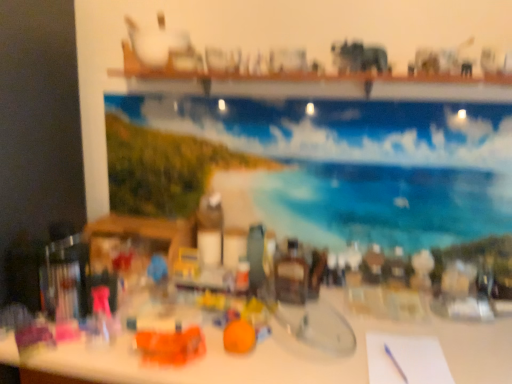
Question: From a real-world perspective, is orange matte toy at center, which is counted as the first toy, starting from the right, located higher than blue glossy painting at upper center?

Choices:
 (A) no
 (B) yes

Answer: (A)

Question: From the image's perspective, does orange matte toy at center, which is the 2th toy from left to right, appear lower than blue glossy painting at upper center?

Choices:
 (A) yes
 (B) no

Answer: (A)

Question: Does orange matte toy at center, which is the 2th toy from left to right, contain blue glossy painting at upper center?

Choices:
 (A) yes
 (B) no

Answer: (B)

Question: Considering the relative sizes of orange matte toy at center, which is the 2th toy from left to right, and blue glossy painting at upper center in the image provided, is orange matte toy at center, which is the 2th toy from left to right, shorter than blue glossy painting at upper center?

Choices:
 (A) yes
 (B) no

Answer: (A)

Question: Is orange matte toy at center, which is counted as the first toy, starting from the right, positioned in front of blue glossy painting at upper center?

Choices:
 (A) no
 (B) yes

Answer: (B)

Question: Can you confirm if orange matte toy at center, which is counted as the first toy, starting from the right, is positioned to the left of blue glossy painting at upper center?

Choices:
 (A) yes
 (B) no

Answer: (A)

Question: Is white glossy table at center closer to camera compared to white paper at lower right?

Choices:
 (A) no
 (B) yes

Answer: (B)

Question: Does white glossy table at center have a greater width compared to white paper at lower right?

Choices:
 (A) no
 (B) yes

Answer: (B)

Question: From a real-world perspective, is white glossy table at center located higher than white paper at lower right?

Choices:
 (A) yes
 (B) no

Answer: (B)

Question: Considering the relative sizes of white glossy table at center and white paper at lower right in the image provided, is white glossy table at center bigger than white paper at lower right?

Choices:
 (A) no
 (B) yes

Answer: (B)

Question: From the image's perspective, is white glossy table at center located above white paper at lower right?

Choices:
 (A) yes
 (B) no

Answer: (B)

Question: Is white glossy table at center turned away from white paper at lower right?

Choices:
 (A) no
 (B) yes

Answer: (A)

Question: Can you confirm if blue glossy painting at upper center is wider than orange plastic toy at center, placed as the first toy when sorted from left to right?

Choices:
 (A) no
 (B) yes

Answer: (A)